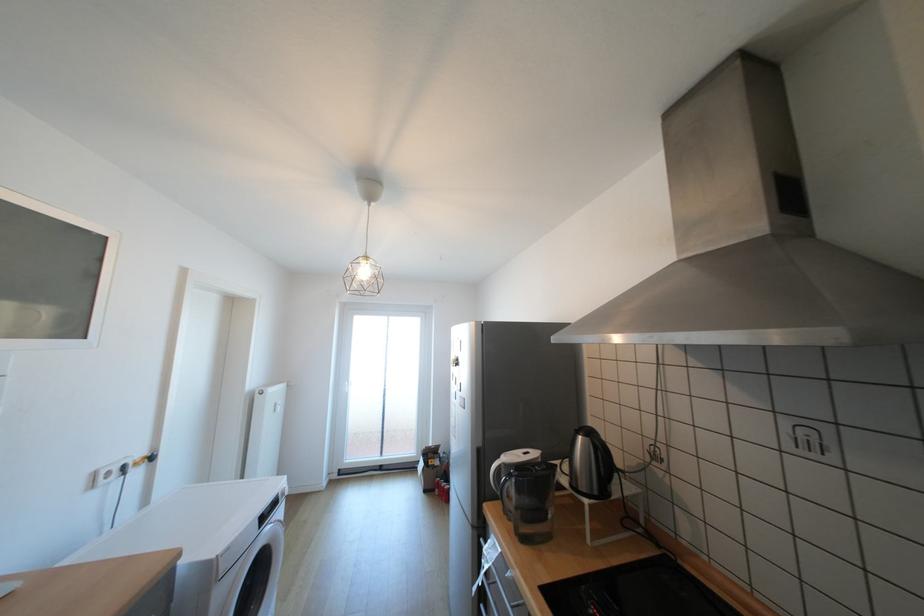
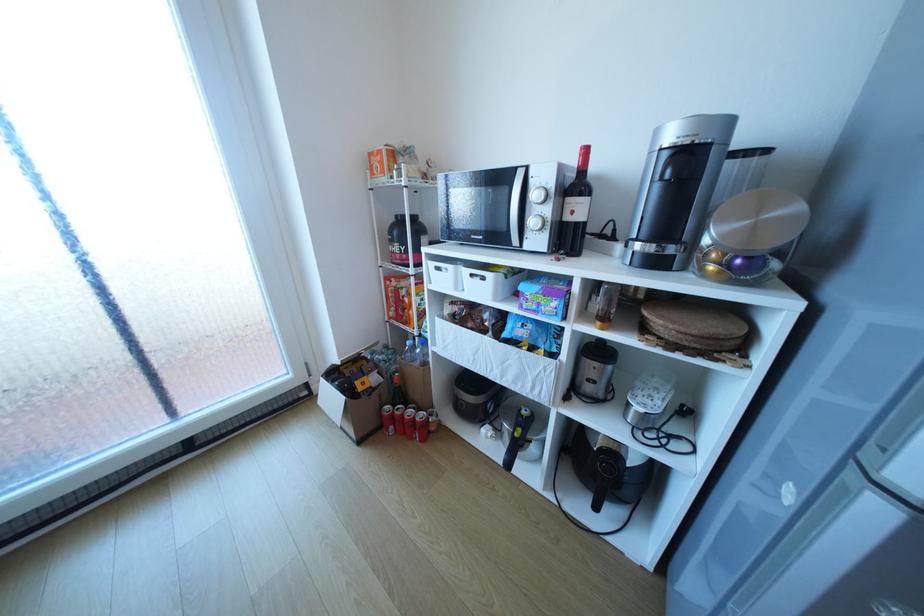
Locate, in the second image, the point that corresponds to [452,499] in the first image.

(420, 438)